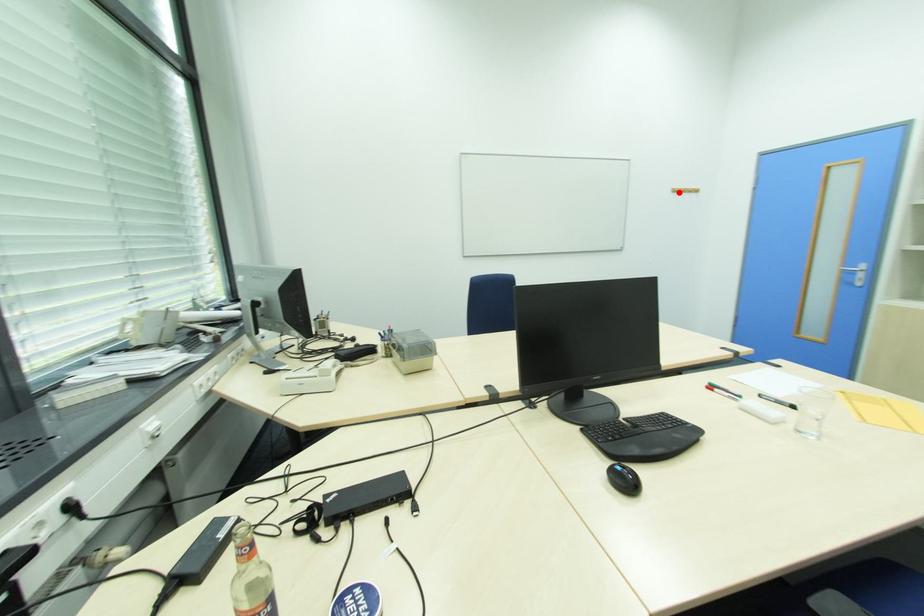
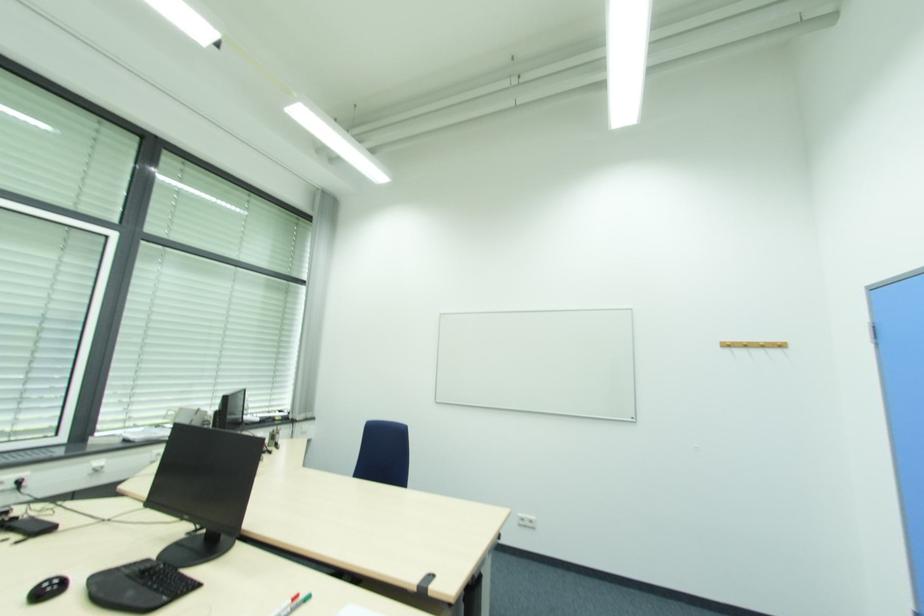
Where in the second image is the point corresponding to the highlighted location from the first image?

(730, 346)